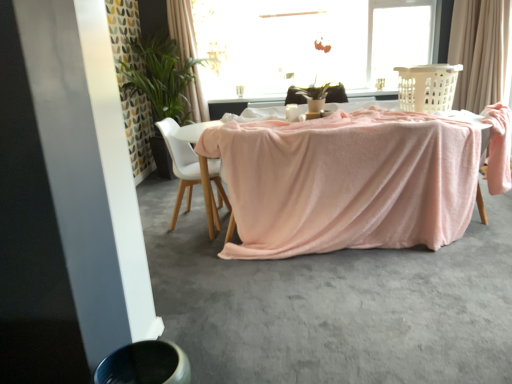
Question: In terms of size, does pink velvety table at center appear bigger or smaller than white matte chair at center?

Choices:
 (A) big
 (B) small

Answer: (A)

Question: Is pink velvety table at center taller or shorter than white matte chair at center?

Choices:
 (A) short
 (B) tall

Answer: (A)

Question: Which is farther from the smooth gray concrete at lower center?

Choices:
 (A) pink fabric armchair at right
 (B) beige plastic laundry basket at upper right
 (C) white matte chair at center
 (D) transparent glass window at upper center
 (E) green leafy plant at upper left

Answer: (D)

Question: Which object is positioned closest to the beige plastic laundry basket at upper right?

Choices:
 (A) pink velvety table at center
 (B) beige fabric curtain at upper right, the 2th curtain in the left-to-right sequence
 (C) green leafy plant at upper left
 (D) white matte chair at center
 (E) transparent glass window at upper center

Answer: (A)